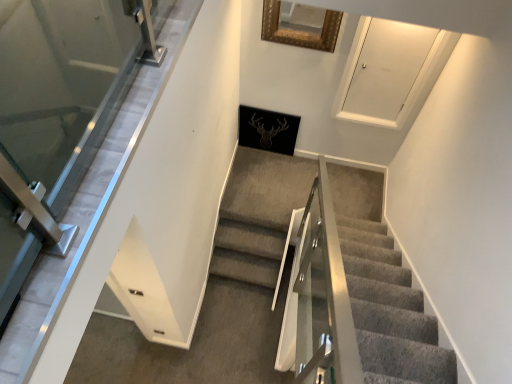
Image resolution: width=512 pixels, height=384 pixels. Identify the location of transparent glass door at left. (60, 87).

This screenshot has height=384, width=512. Describe the element at coordinates (60, 87) in the screenshot. I see `transparent glass door at left` at that location.

In order to face transparent glass door at left, should I rotate leftwards or rightwards?

Rotate your view left by about 23.579°.

At what (x,y) coordinates should I click in order to perform the action: click on transparent glass door at left. Please return your answer as a coordinate pair (x, y). The height and width of the screenshot is (384, 512). Looking at the image, I should click on (60, 87).